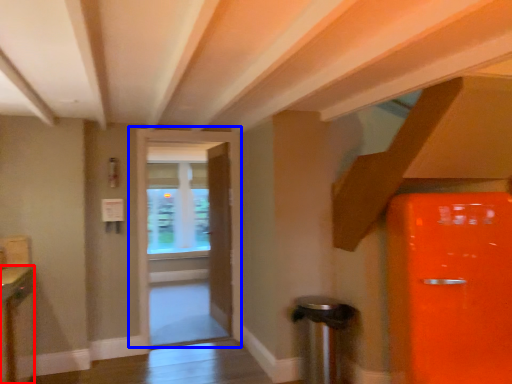
Question: Which object is closer to the camera taking this photo, cabinetry (highlighted by a red box) or door (highlighted by a blue box)?

Choices:
 (A) cabinetry
 (B) door

Answer: (A)